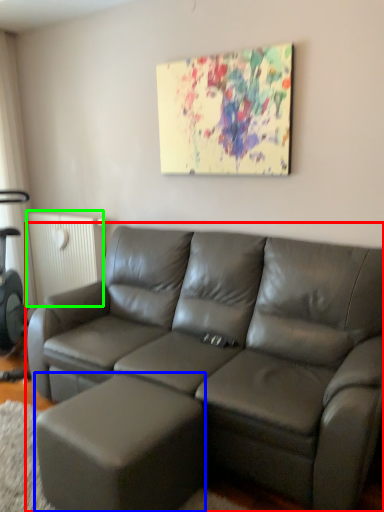
Question: Which object is positioned farthest from studio couch (highlighted by a red box)? Select from bar stool (highlighted by a blue box) and radiator (highlighted by a green box).

Choices:
 (A) bar stool
 (B) radiator

Answer: (B)